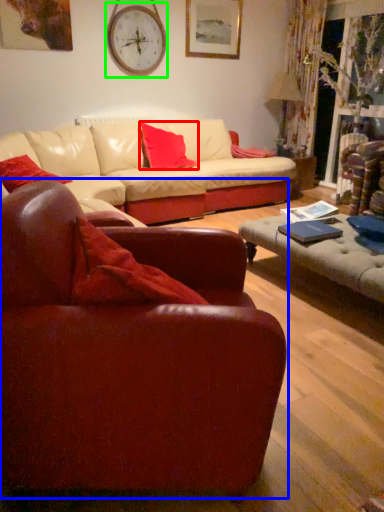
Question: Which object is the farthest from pillow (highlighted by a red box)? Choose among these: studio couch (highlighted by a blue box) or clock (highlighted by a green box).

Choices:
 (A) studio couch
 (B) clock

Answer: (A)